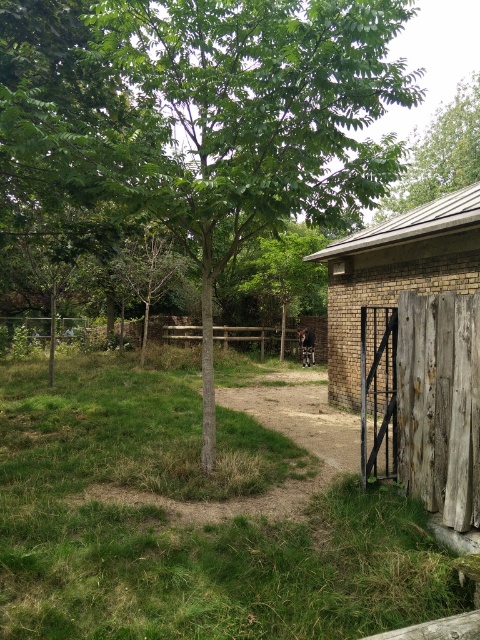
Based on the photo, can you confirm if brown brick barn at upper right is bigger than green leafy tree at upper center?

Correct, brown brick barn at upper right is larger in size than green leafy tree at upper center.

What are the coordinates of `brown brick barn at upper right` in the screenshot? It's located at (396, 273).

Who is more forward, (384, 248) or (443, 173)?

Point (384, 248) is more forward.

At what (x,y) coordinates should I click in order to perform the action: click on brown brick barn at upper right. Please return your answer as a coordinate pair (x, y). Image resolution: width=480 pixels, height=640 pixels. Looking at the image, I should click on (396, 273).

Is green grass at lower left shorter than weathered wood gate at lower right?

Yes, green grass at lower left is shorter than weathered wood gate at lower right.

Is point (175, 616) behind point (361, 432)?

No.

This screenshot has width=480, height=640. I want to click on green grass at lower left, so click(188, 525).

Who is positioned more to the left, green grass at lower left or brown furry animal at center?

Positioned to the left is green grass at lower left.

Does green grass at lower left have a greater width compared to brown furry animal at center?

Correct, the width of green grass at lower left exceeds that of brown furry animal at center.

Who is more forward, (15, 554) or (305, 346)?

Point (15, 554) is in front.

The image size is (480, 640). Identify the location of green grass at lower left. (188, 525).